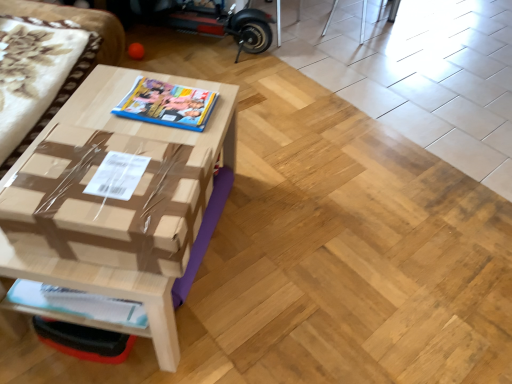
Question: Considering the relative sizes of white glossy magazine at lower left, the first magazine ordered from the bottom, and brown cardboard couch at left in the image provided, is white glossy magazine at lower left, the first magazine ordered from the bottom, thinner than brown cardboard couch at left?

Choices:
 (A) no
 (B) yes

Answer: (B)

Question: From the image's perspective, is white glossy magazine at lower left, acting as the second magazine starting from the top, on brown cardboard couch at left?

Choices:
 (A) yes
 (B) no

Answer: (B)

Question: From the image's perspective, is white glossy magazine at lower left, marked as the 1th magazine in a front-to-back arrangement, below brown cardboard couch at left?

Choices:
 (A) no
 (B) yes

Answer: (B)

Question: Is white glossy magazine at lower left, marked as the 1th magazine in a front-to-back arrangement, oriented towards brown cardboard couch at left?

Choices:
 (A) no
 (B) yes

Answer: (A)

Question: Can we say white glossy magazine at lower left, arranged as the second magazine when viewed from the back, lies outside brown cardboard couch at left?

Choices:
 (A) no
 (B) yes

Answer: (B)

Question: Considering the positions of matte plastic magazine at center, which is counted as the first magazine, starting from the back, and brown cardboard table at center in the image, is matte plastic magazine at center, which is counted as the first magazine, starting from the back, wider or thinner than brown cardboard table at center?

Choices:
 (A) wide
 (B) thin

Answer: (B)

Question: In terms of size, does matte plastic magazine at center, which is the second magazine from bottom to top, appear bigger or smaller than brown cardboard table at center?

Choices:
 (A) big
 (B) small

Answer: (B)

Question: Do you think matte plastic magazine at center, placed as the 2th magazine when sorted from front to back, is within brown cardboard table at center, or outside of it?

Choices:
 (A) outside
 (B) inside

Answer: (A)

Question: Does point (167, 102) appear closer or farther from the camera than point (134, 263)?

Choices:
 (A) closer
 (B) farther

Answer: (B)

Question: Considering the relative positions of brown cardboard couch at left and brown cardboard table at center in the image provided, is brown cardboard couch at left to the left or to the right of brown cardboard table at center?

Choices:
 (A) left
 (B) right

Answer: (A)

Question: Is brown cardboard couch at left situated inside brown cardboard table at center or outside?

Choices:
 (A) inside
 (B) outside

Answer: (B)

Question: From a real-world perspective, is brown cardboard couch at left above or below brown cardboard table at center?

Choices:
 (A) below
 (B) above

Answer: (B)

Question: Is point (89, 14) positioned closer to the camera than point (95, 253)?

Choices:
 (A) farther
 (B) closer

Answer: (A)

Question: Looking at their shapes, would you say white glossy magazine at lower left, arranged as the second magazine when viewed from the back, is wider or thinner than brown cardboard box at center?

Choices:
 (A) thin
 (B) wide

Answer: (A)

Question: Does point (103, 317) appear closer or farther from the camera than point (22, 188)?

Choices:
 (A) closer
 (B) farther

Answer: (B)